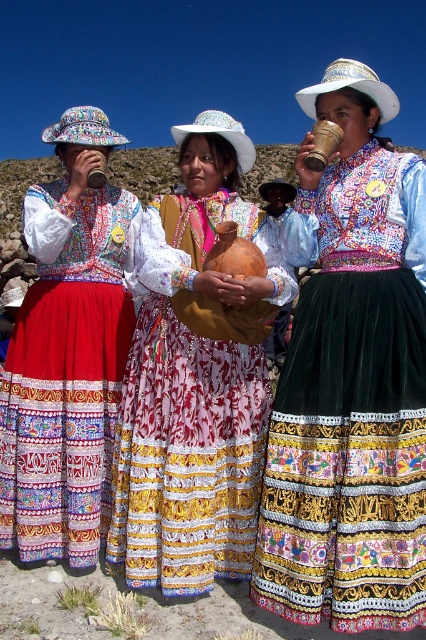
Is matte brown clay cup at center taller than matte black cup at left?

Indeed, matte brown clay cup at center has a greater height compared to matte black cup at left.

Between matte brown clay cup at center and matte black cup at left, which one is positioned lower?

Positioned lower is matte brown clay cup at center.

Which is behind, point (412, 461) or point (0, 403)?

The point (0, 403) is more distant.

Locate an element on the screen. This screenshot has width=426, height=640. matte brown clay cup at center is located at coordinates (351, 380).

Does matte brown clay cup at center have a smaller size compared to matte brown clay pot at center?

No, matte brown clay cup at center is not smaller than matte brown clay pot at center.

Which of these two, matte brown clay cup at center or matte brown clay pot at center, stands shorter?

Standing shorter between the two is matte brown clay pot at center.

Which is behind, point (339, 589) or point (253, 300)?

Positioned behind is point (253, 300).

Locate an element on the screen. The width and height of the screenshot is (426, 640). matte brown clay cup at center is located at coordinates (351, 380).

Identify the location of matte brown clay pot at center. This screenshot has height=640, width=426. (195, 378).

Between matte brown clay pot at center and matte black cup at left, which one has more height?

With more height is matte black cup at left.

Is point (209, 148) positioned after point (58, 147)?

No, (209, 148) is in front of (58, 147).

Image resolution: width=426 pixels, height=640 pixels. Find the location of `matte brown clay pot at center`. matte brown clay pot at center is located at coordinates (195, 378).